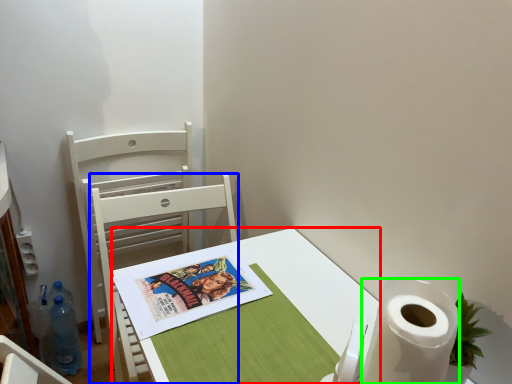
Question: Which object is positioned closest to desk (highlighted by a red box)? Select from chair (highlighted by a blue box) and paper towel (highlighted by a green box).

Choices:
 (A) chair
 (B) paper towel

Answer: (B)